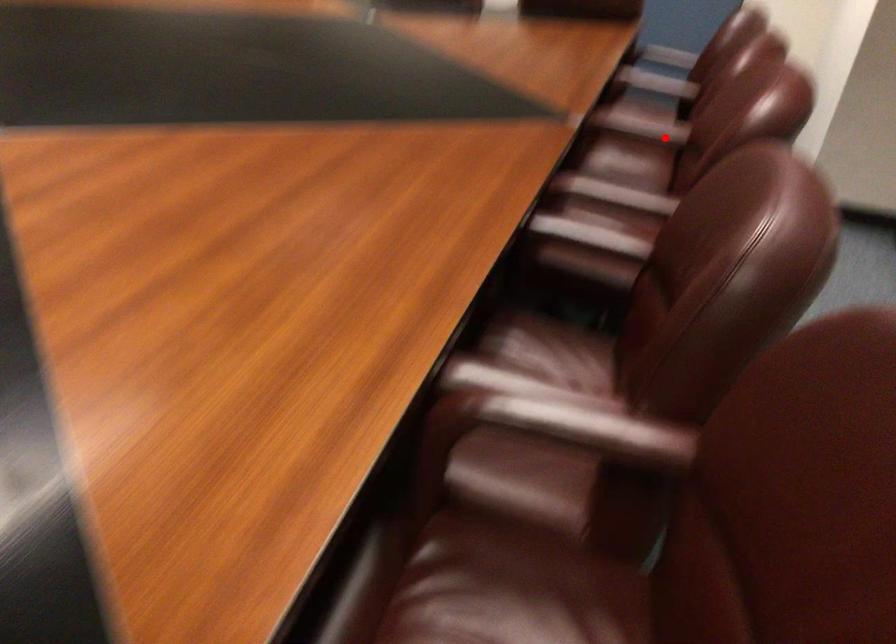
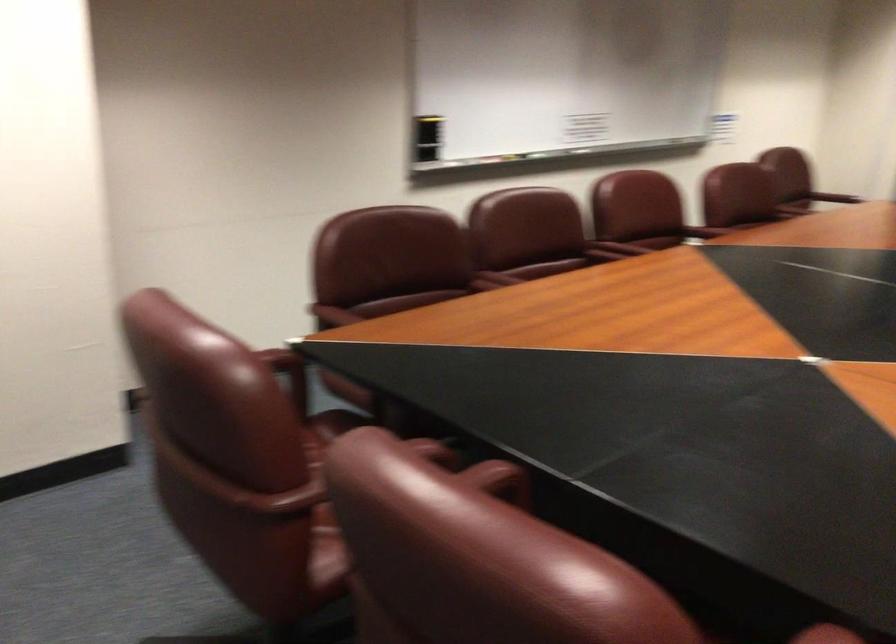
Locate, in the second image, the point that corresponds to the highlighted location in the first image.

(618, 247)